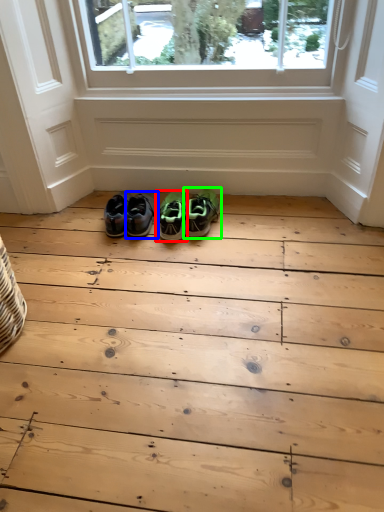
Question: Considering the real-world distances, which object is closest to footwear (highlighted by a red box)? footwear (highlighted by a blue box) or footwear (highlighted by a green box).

Choices:
 (A) footwear
 (B) footwear

Answer: (B)